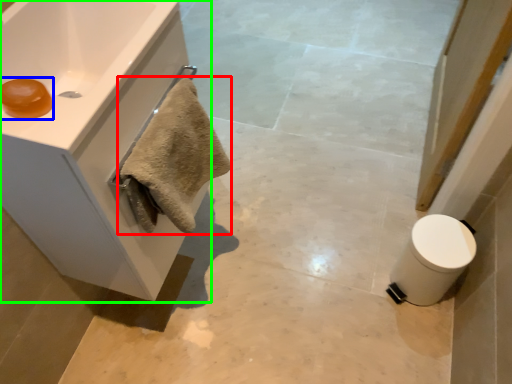
Question: Which object is the closest to the bath towel (highlighted by a red box)? Choose among these: soap (highlighted by a blue box) or bathroom cabinet (highlighted by a green box).

Choices:
 (A) soap
 (B) bathroom cabinet

Answer: (B)